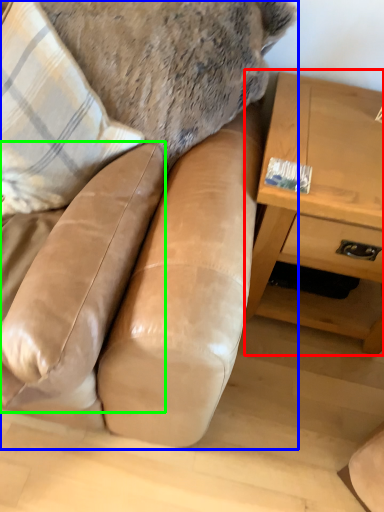
Question: Based on their relative distances, which object is farther from table (highlighted by a red box)? Choose from studio couch (highlighted by a blue box) and swivel chair (highlighted by a green box).

Choices:
 (A) studio couch
 (B) swivel chair

Answer: (B)